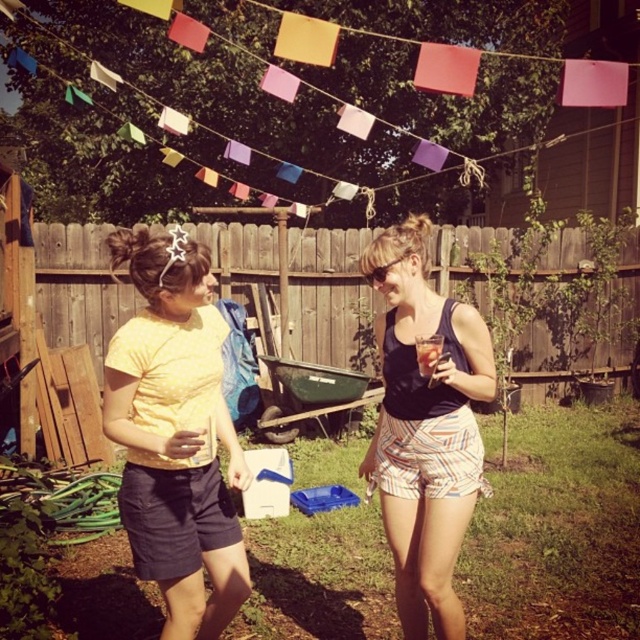
Question: Which point is closer to the camera taking this photo?

Choices:
 (A) (390, 538)
 (B) (216, 316)

Answer: (B)

Question: Which object is closer to the camera taking this photo?

Choices:
 (A) yellow dotted shirt at center
 (B) colorful paper flags at upper center

Answer: (A)

Question: Which point appears farthest from the camera in this image?

Choices:
 (A) (426, 179)
 (B) (188, 506)
 (C) (465, 401)

Answer: (A)

Question: Considering the relative positions of yellow dotted shirt at center and matte black tank top at center in the image provided, where is yellow dotted shirt at center located with respect to matte black tank top at center?

Choices:
 (A) left
 (B) right

Answer: (A)

Question: Can you confirm if colorful paper flags at upper center is positioned to the left of matte black tank top at center?

Choices:
 (A) no
 (B) yes

Answer: (B)

Question: In this image, where is colorful paper flags at upper center located relative to matte black tank top at center?

Choices:
 (A) below
 (B) above

Answer: (B)